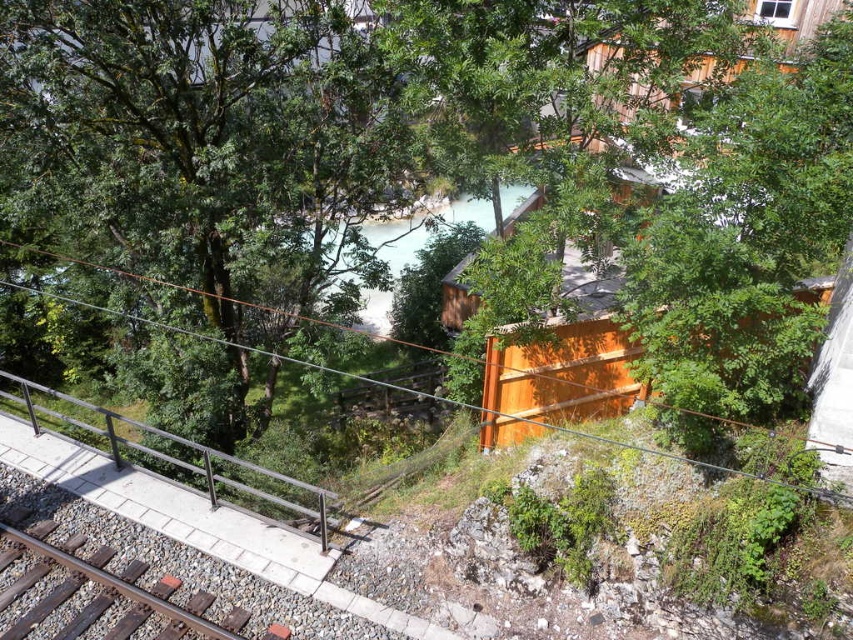
Question: Is green leafy tree at center thinner than brown metal train track at lower left?

Choices:
 (A) yes
 (B) no

Answer: (B)

Question: Which object is the farthest from the green leafy tree at center?

Choices:
 (A) metal/rustic rail at lower left
 (B) brown metal train track at lower left

Answer: (B)

Question: Estimate the real-world distances between objects in this image. Which object is closer to the brown metal train track at lower left?

Choices:
 (A) green leafy tree at center
 (B) metal/rustic rail at lower left

Answer: (B)

Question: Among these points, which one is nearest to the camera?

Choices:
 (A) (57, 548)
 (B) (663, 304)

Answer: (B)

Question: From the image, what is the correct spatial relationship of green leafy tree at center in relation to metal/rustic rail at lower left?

Choices:
 (A) right
 (B) left

Answer: (A)

Question: Can you confirm if green leafy tree at center is bigger than metal/rustic rail at lower left?

Choices:
 (A) yes
 (B) no

Answer: (A)